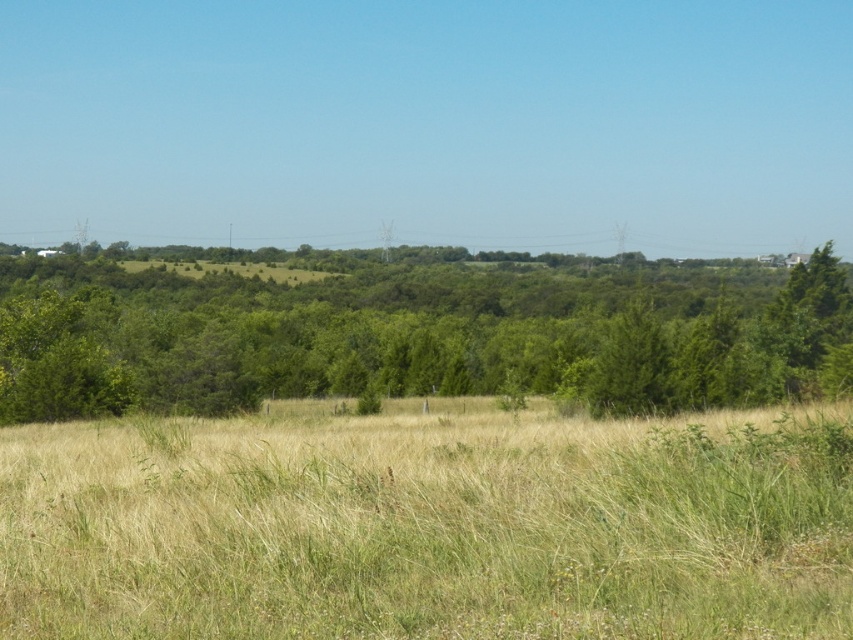
You are a hiker trying to navigate through the dry grass at center and the green leafy tree at center. Which of these two objects is smaller in size?

The dry grass at center is smaller in size compared to the green leafy tree at center.

You are standing in the rural landscape and want to take a photo of the dry grass at center and the green leafy tree at center. Which object will appear closer to the bottom of your photo?

The dry grass at center will appear closer to the bottom of the photo because it is positioned below the green leafy tree at center.

You are standing at the origin point of the coordinate system in the image. You want to walk to the dry grass at center. Which direction should you move in to reach it?

The dry grass at center is located at coordinate point 0.823 on the x axis and 0.505 on the y axis. Since you are at the origin point, you should move towards the positive x and positive y direction to reach it.